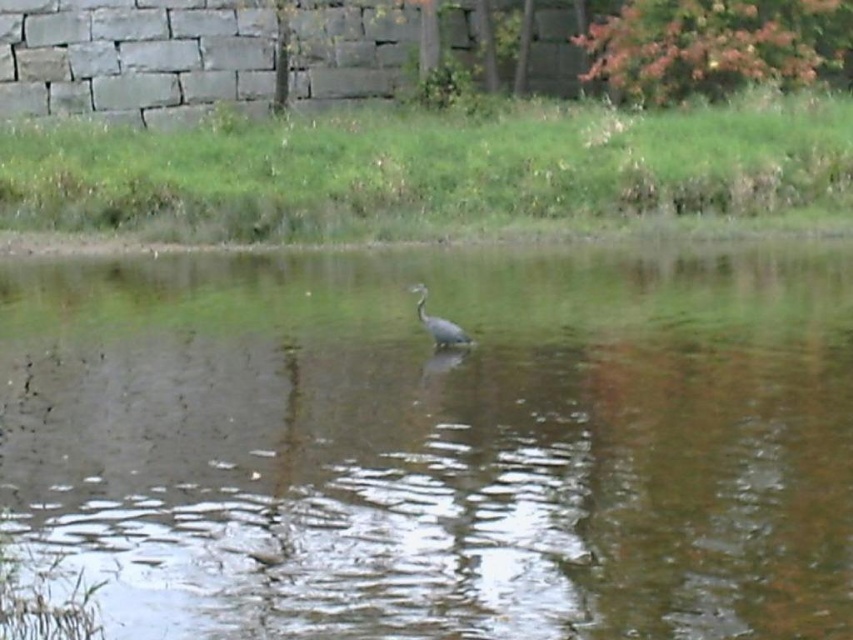
Question: Among these objects, which one is nearest to the camera?

Choices:
 (A) gray matte bird at center
 (B) brown murky water at center

Answer: (B)

Question: Can you confirm if brown murky water at center is smaller than gray matte bird at center?

Choices:
 (A) no
 (B) yes

Answer: (A)

Question: From the image, what is the correct spatial relationship of brown murky water at center in relation to gray matte bird at center?

Choices:
 (A) left
 (B) right

Answer: (B)

Question: Does brown murky water at center have a larger size compared to gray matte bird at center?

Choices:
 (A) no
 (B) yes

Answer: (B)

Question: Among these points, which one is farthest from the camera?

Choices:
 (A) [456, 328]
 (B) [503, 536]

Answer: (A)